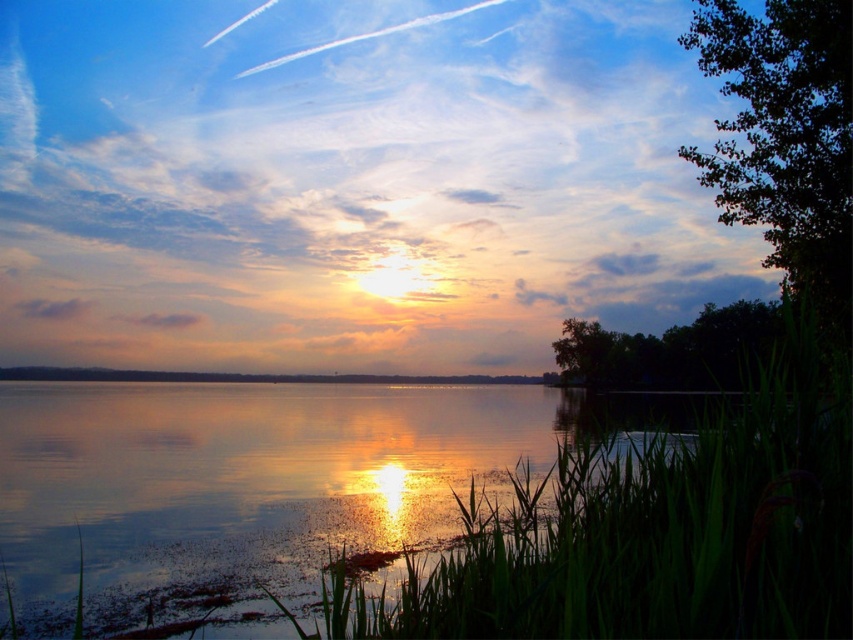
I want to click on dark green leafy tree at upper right, so click(x=785, y=138).

Does point (740, 204) lie in front of point (701, 320)?

That is True.

Locate an element on the screen. dark green leafy tree at upper right is located at coordinates (785, 138).

Which is behind, point (612, 429) or point (718, 333)?

The point (718, 333) is behind.

Is glistening water at center shorter than green leafy tree at right?

Yes.

This screenshot has width=853, height=640. In order to click on glistening water at center in this screenshot , I will do `click(264, 468)`.

Locate an element on the screen. glistening water at center is located at coordinates (264, 468).

Is glistening water at center to the left of dark green leafy tree at upper right from the viewer's perspective?

Indeed, glistening water at center is positioned on the left side of dark green leafy tree at upper right.

Between glistening water at center and dark green leafy tree at upper right, which one has less height?

Standing shorter between the two is glistening water at center.

This screenshot has width=853, height=640. In order to click on glistening water at center in this screenshot , I will do `click(264, 468)`.

Where is `glistening water at center`? The height and width of the screenshot is (640, 853). glistening water at center is located at coordinates (264, 468).